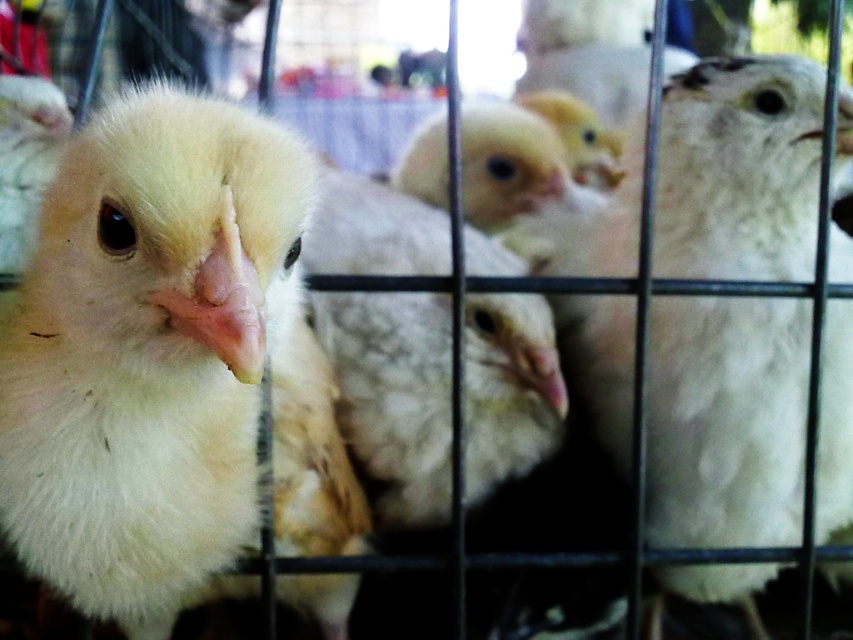
You are a farmer checking the chicks in the cage. You notice two chicks at the center of the cage labeled as fluffy white chick at center and white fluffy chick at center. Which one is smaller in width?

The fluffy white chick at center has a lesser width compared to the white fluffy chick at center, so the fluffy white chick at center is smaller in width.

You are an animal caretaker observing the image. The cage has a feeding tray located at coordinate point 0.570, 0.197. Is the fluffy white chick at center positioned directly above the feeding tray?

The 2D location of the fluffy white chick at center is at point (167, 364), which matches the coordinates of the feeding tray. Therefore, the fluffy white chick at center is positioned directly above the feeding tray.